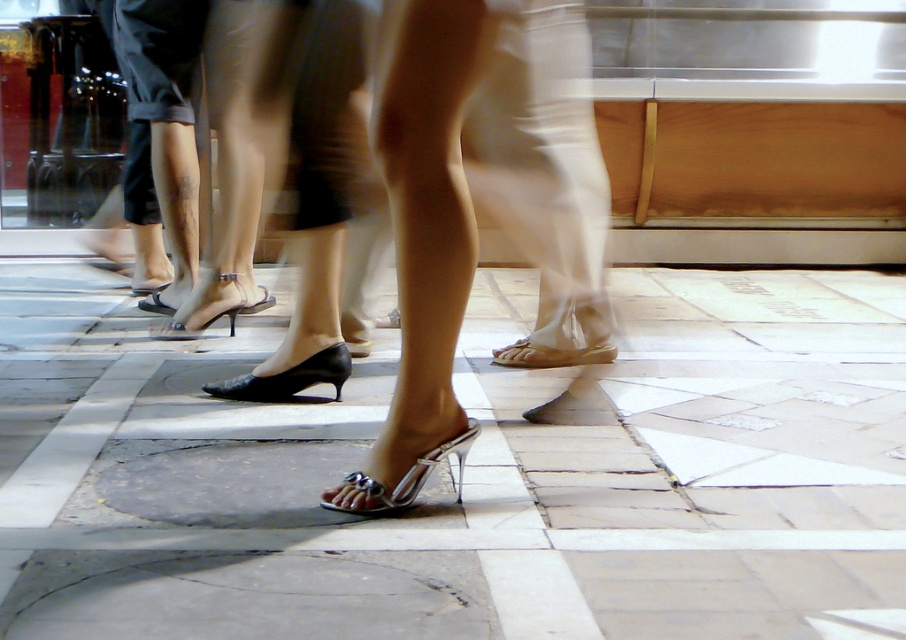
Question: Does silver metallic sandal at center have a larger size compared to black leather shoe at center?

Choices:
 (A) yes
 (B) no

Answer: (A)

Question: Based on their relative distances, which object is farther from the black leather sandal at center?

Choices:
 (A) metallic silver sandals at center
 (B) black leather shoe at center
 (C) white stone pavement at center

Answer: (A)

Question: Is metallic silver sandals at center thinner than black leather shoe at center?

Choices:
 (A) yes
 (B) no

Answer: (B)

Question: Which object appears closest to the camera in this image?

Choices:
 (A) black leather sandal at center
 (B) black leather shoe at center

Answer: (B)

Question: Does silver metallic sandal at center appear on the left side of black leather sandal at center?

Choices:
 (A) no
 (B) yes

Answer: (A)

Question: Among these points, which one is farthest from the camera?

Choices:
 (A) tap(211, 385)
 (B) tap(227, 275)
 (C) tap(413, 282)

Answer: (B)